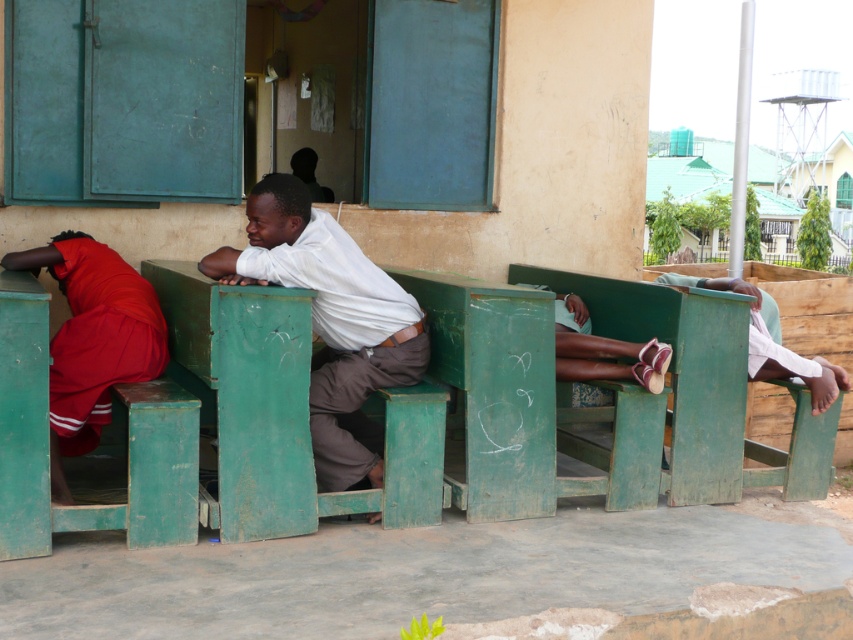
Question: Considering the relative positions of white matte shirt at center and matte white shirt at center in the image provided, where is white matte shirt at center located with respect to matte white shirt at center?

Choices:
 (A) above
 (B) below

Answer: (A)

Question: Where is white matte shirt at center located in relation to matte white shirt at center in the image?

Choices:
 (A) below
 (B) above

Answer: (B)

Question: Which point is closer to the camera taking this photo?

Choices:
 (A) (380, 385)
 (B) (64, 477)

Answer: (B)

Question: Among these points, which one is nearest to the camera?

Choices:
 (A) (62, 483)
 (B) (384, 333)

Answer: (A)

Question: Which of the following is the closest to the observer?

Choices:
 (A) (276, 225)
 (B) (15, 268)

Answer: (A)

Question: From the image, what is the correct spatial relationship of white matte shirt at center in relation to matte white shirt at center?

Choices:
 (A) above
 (B) below

Answer: (A)